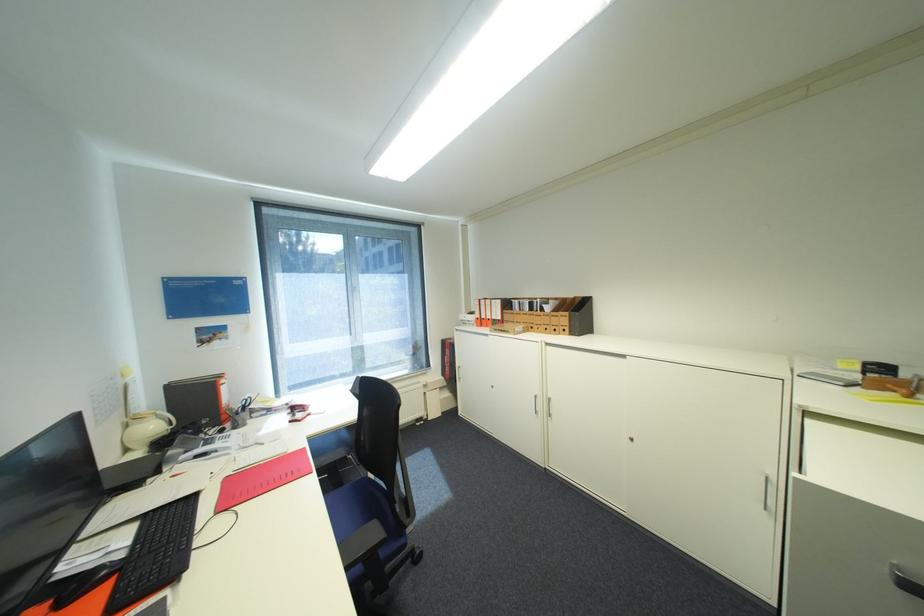
Find where to rest the black chair armrest. Please return your answer as a coordinate pair (x, y).

(363, 561)